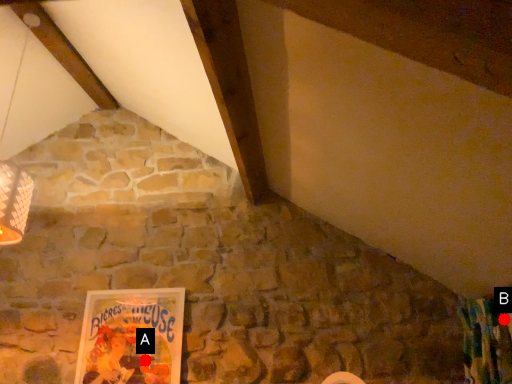
Question: Two points are circled on the image, labeled by A and B beside each circle. Which point is further to the camera?

Choices:
 (A) A is further
 (B) B is further

Answer: (A)